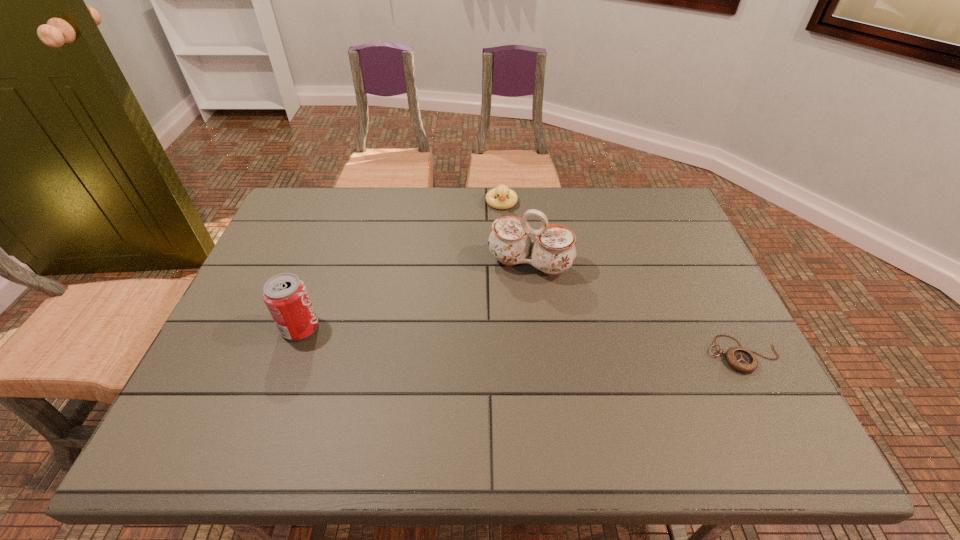
Where is `soda can`? The image size is (960, 540). soda can is located at coordinates (285, 295).

Where is `the second tallest object`? the second tallest object is located at coordinates (285, 295).

Where is `pocket watch`? This screenshot has height=540, width=960. pocket watch is located at coordinates (741, 359).

I want to click on the rightmost object, so click(x=741, y=359).

Locate an element on the screen. duckling is located at coordinates (502, 191).

The width and height of the screenshot is (960, 540). Find the location of `the second shortest object`. the second shortest object is located at coordinates (502, 191).

This screenshot has height=540, width=960. I want to click on chinaware, so click(x=553, y=252).

At what (x,y) coordinates should I click in order to perform the action: click on free location located on the right of the soda can. Please return your answer as a coordinate pair (x, y). Looking at the image, I should click on (429, 327).

Identify the location of vacant space located on the left of the shortest object. This screenshot has height=540, width=960. (584, 354).

I want to click on free space located at the beak of the second shortest object, so click(504, 289).